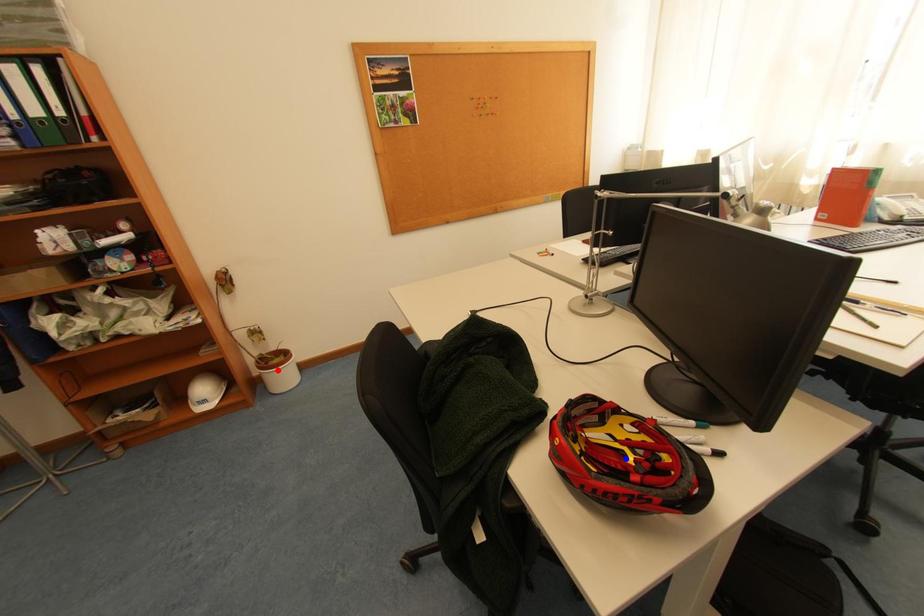
Question: In the image, two points are highlighted. Which point is nearer to the camera? Reply with the corresponding letter.

Choices:
 (A) blue point
 (B) red point

Answer: (A)